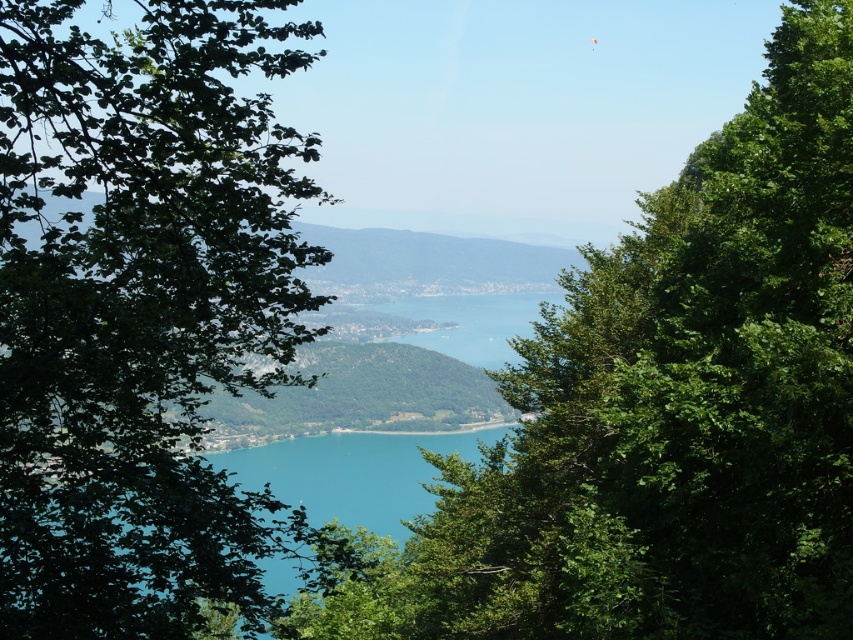
Question: Does green leafy tree at center have a lesser width compared to turquoise water at center?

Choices:
 (A) yes
 (B) no

Answer: (A)

Question: Is the position of green leafy tree at left more distant than that of turquoise water at center?

Choices:
 (A) yes
 (B) no

Answer: (B)

Question: Among these objects, which one is farthest from the camera?

Choices:
 (A) green leafy tree at left
 (B) green leafy tree at center
 (C) turquoise water at center
 (D) green leafy hill at center

Answer: (C)

Question: Which is farther from the turquoise water at center?

Choices:
 (A) green leafy tree at left
 (B) green leafy tree at center

Answer: (B)

Question: Can you confirm if green leafy tree at left is bigger than green leafy hill at center?

Choices:
 (A) no
 (B) yes

Answer: (B)

Question: Which object is positioned farthest from the green leafy hill at center?

Choices:
 (A) green leafy tree at center
 (B) green leafy tree at left

Answer: (A)